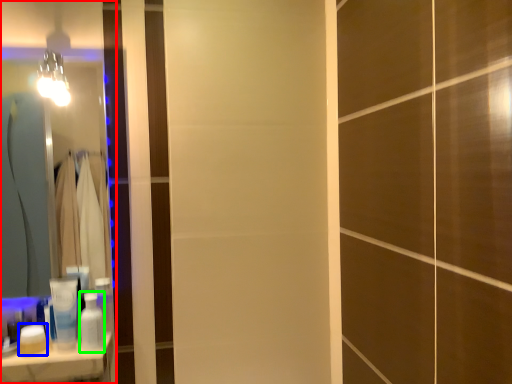
Question: Which object is the closest to the mirror (highlighted by a red box)? Choose among these: toiletry (highlighted by a blue box) or toiletry (highlighted by a green box).

Choices:
 (A) toiletry
 (B) toiletry

Answer: (B)